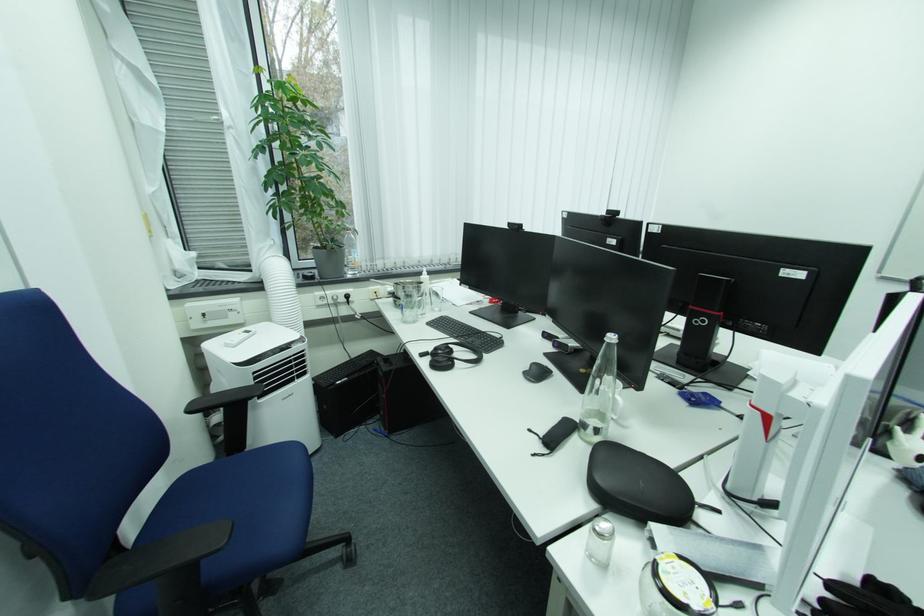
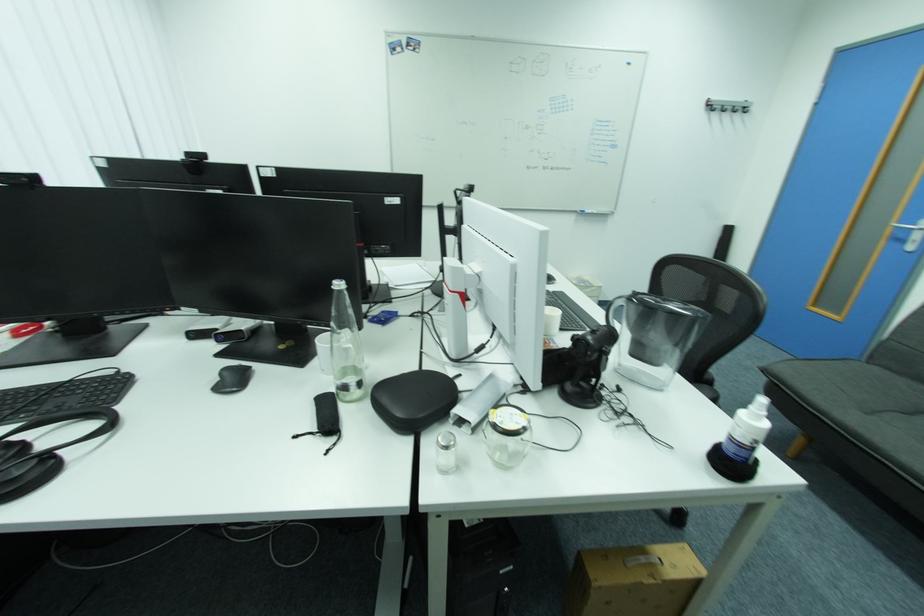
In the second image, find the point that corresponds to point (611, 342) in the first image.

(339, 292)